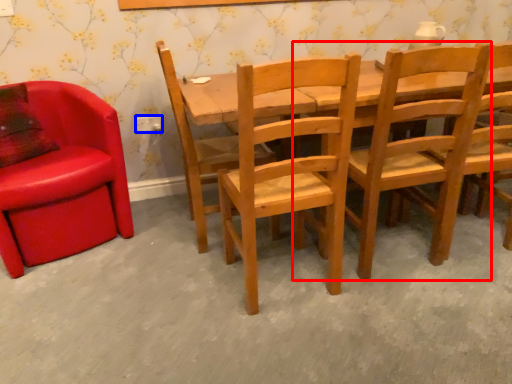
Question: Which of the following is the closest to the observer, chair (highlighted by a red box) or power outlet (highlighted by a blue box)?

Choices:
 (A) chair
 (B) power outlet

Answer: (A)